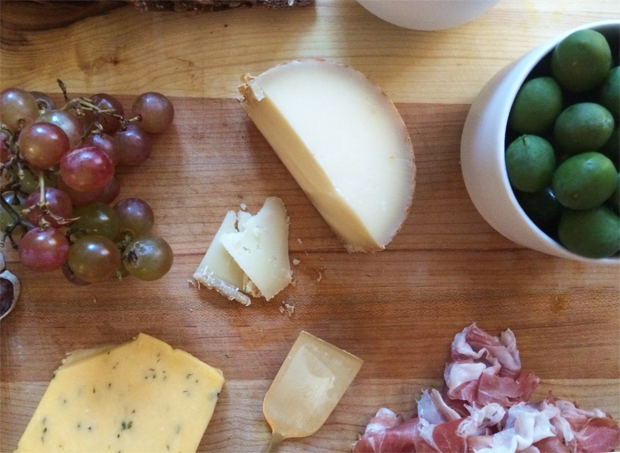
Where is `white bowl`? The width and height of the screenshot is (620, 453). white bowl is located at coordinates (495, 178).